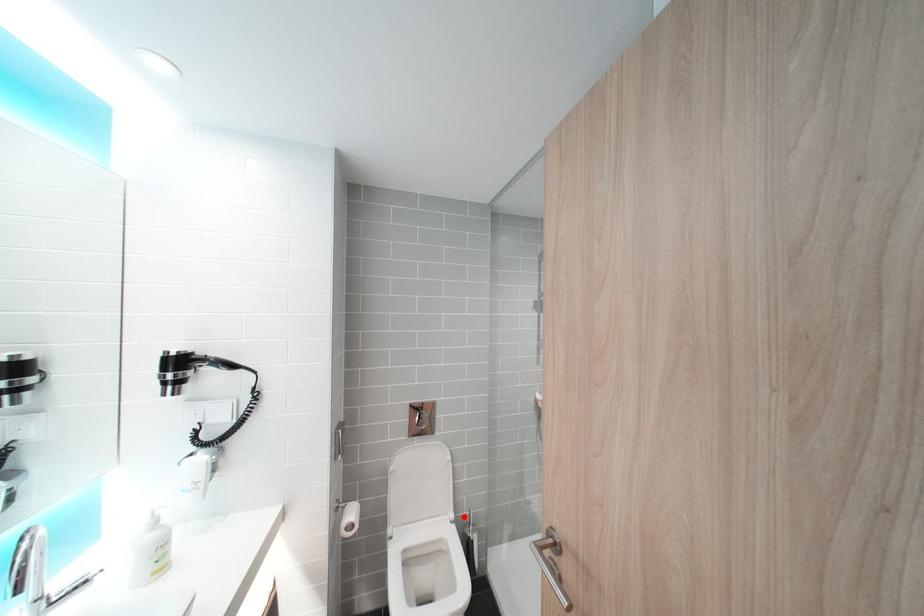
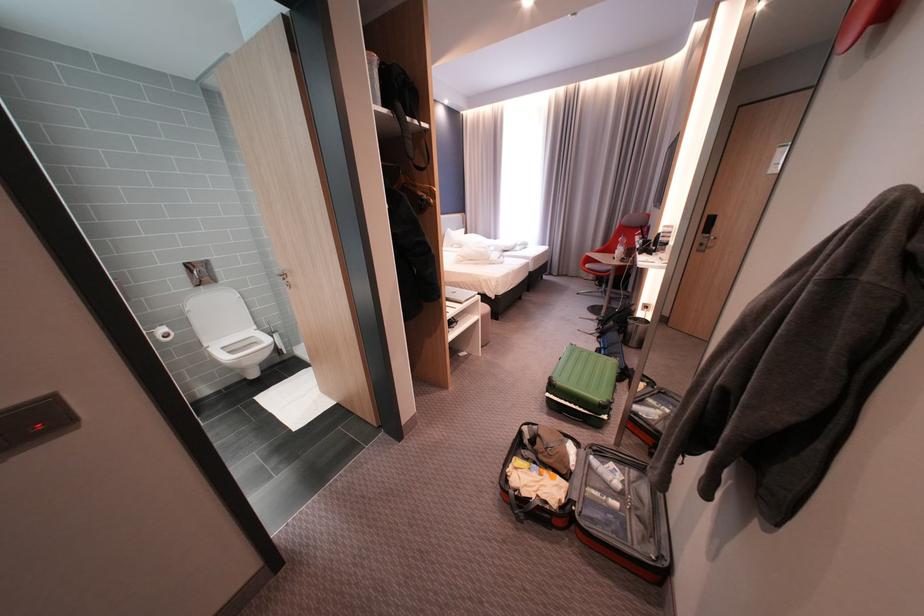
Where in the second image is the point corresponding to the highlighted location from the first image?

(266, 328)